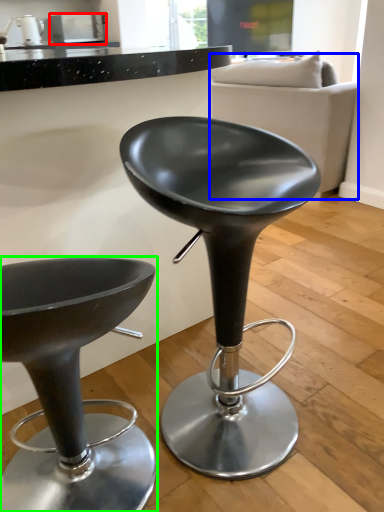
Question: Which is nearer to the appliance (highlighted by a red box)? couch (highlighted by a blue box) or chair (highlighted by a green box).

Choices:
 (A) couch
 (B) chair

Answer: (A)